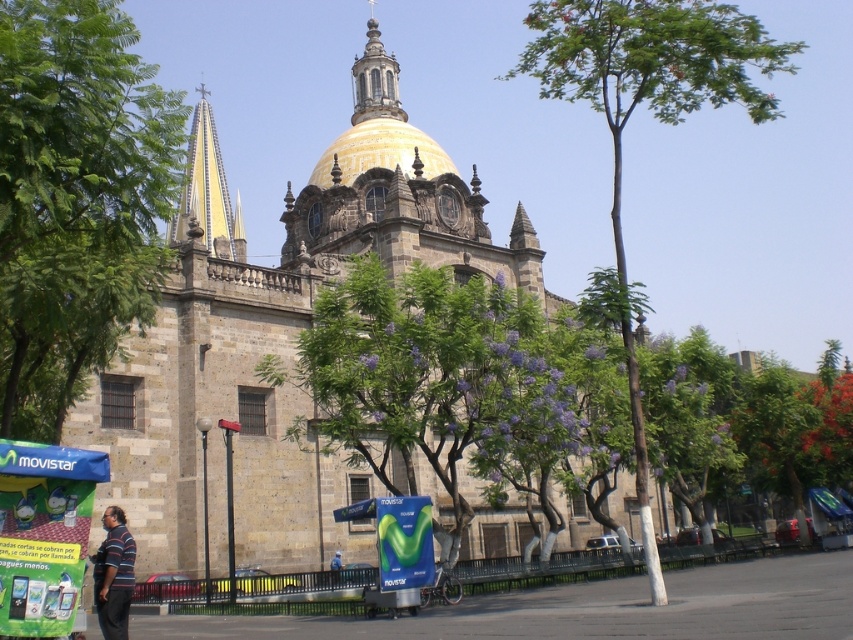
Is point (184, 406) positioned behind point (112, 554)?

Yes, it is behind point (112, 554).

Who is more distant from viewer, (500, 276) or (103, 595)?

The point (500, 276) is more distant.

The image size is (853, 640). Identify the location of stone church at center. (287, 336).

Does striped cotton shirt at lower left appear over blue fabric jacket at center?

Correct, striped cotton shirt at lower left is located above blue fabric jacket at center.

Is striped cotton shirt at lower left shorter than blue fabric jacket at center?

No, striped cotton shirt at lower left is not shorter than blue fabric jacket at center.

Between point (111, 620) and point (335, 580), which one is positioned behind?

Point (335, 580)

Where is `striped cotton shirt at lower left`? striped cotton shirt at lower left is located at coordinates (113, 576).

Who is more forward, (172,154) or (183,195)?

Point (172,154) is more forward.

Which is in front, point (32, 74) or point (195, 173)?

Positioned in front is point (32, 74).

Identify the location of green leafy tree at left. Image resolution: width=853 pixels, height=640 pixels. (74, 198).